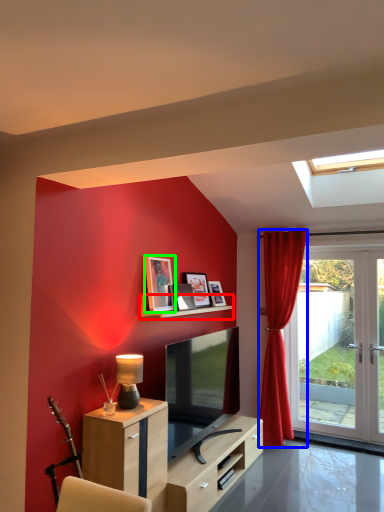
Question: Estimate the real-world distances between objects in this image. Which object is farther from shelf (highlighted by a red box), curtain (highlighted by a blue box) or picture frame (highlighted by a green box)?

Choices:
 (A) curtain
 (B) picture frame

Answer: (A)